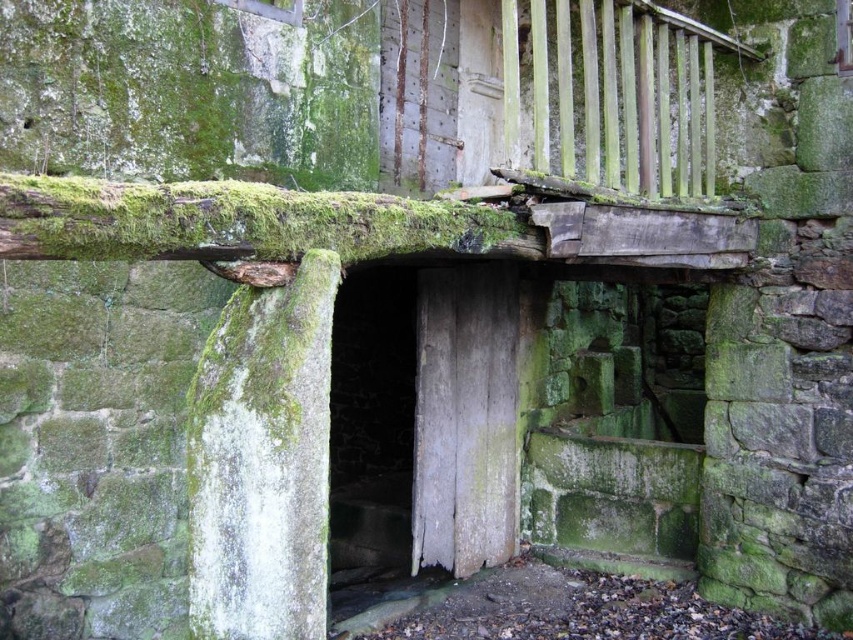
Can you confirm if green wooden rail at upper right is wider than green mossy log at upper center?

Indeed, green wooden rail at upper right has a greater width compared to green mossy log at upper center.

Is green wooden rail at upper right thinner than green mossy log at upper center?

Incorrect, green wooden rail at upper right's width is not less than green mossy log at upper center's.

Does point (579, 22) come in front of point (117, 241)?

That is False.

The width and height of the screenshot is (853, 640). I want to click on green wooden rail at upper right, so click(x=614, y=93).

Between green wooden rail at upper right and weathered wood door at center, which one has less height?

Standing shorter between the two is green wooden rail at upper right.

Image resolution: width=853 pixels, height=640 pixels. I want to click on green wooden rail at upper right, so click(614, 93).

Is green mossy log at upper center to the right of weathered wood door at center from the viewer's perspective?

No, green mossy log at upper center is not to the right of weathered wood door at center.

Between point (22, 234) and point (436, 278), which one is positioned in front?

Point (22, 234)

Locate an element on the screen. Image resolution: width=853 pixels, height=640 pixels. green mossy log at upper center is located at coordinates (239, 221).